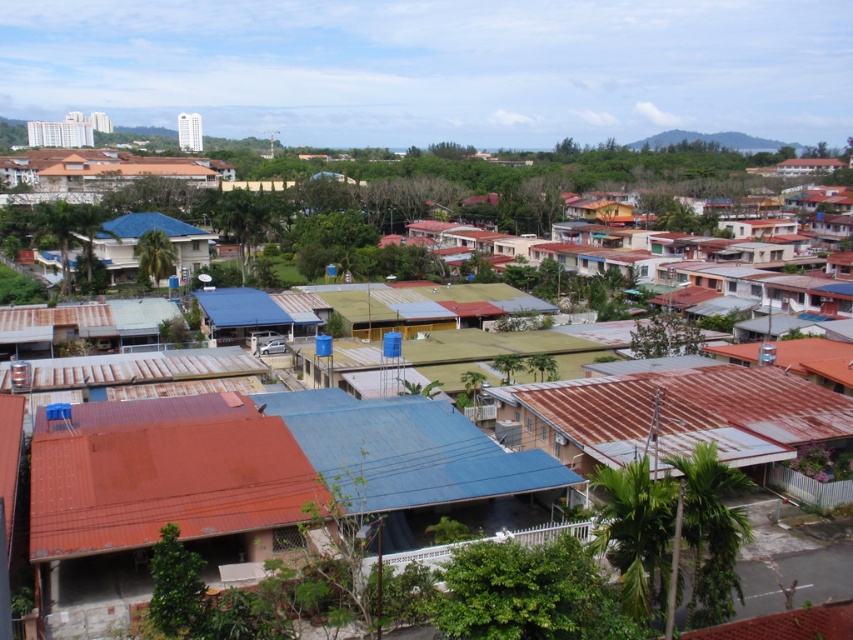
You are standing at the center of the residential area and want to locate the rusty metal hut at lower right. According to the coordinates provided, in which direction should you move to reach it?

The rusty metal hut at lower right is located at point (674, 417). Since you are at the center, moving towards the lower right direction will lead you to the rusty metal hut at lower right.

You are a delivery person trying to navigate through the residential area. You need to deliver a package to the blue matte house at center. From your current position at the rusty metal hut at lower right, which direction should you move to reach the house?

The rusty metal hut at lower right is positioned under the blue matte house at center, so you should move upward from the rusty metal hut at lower right to reach the blue matte house at center.

You are standing in the residential area and want to take a photo of the rusty corrugated metal hut at lower left without the rusty metal hut at lower right blocking the view. Is this possible?

The rusty corrugated metal hut at lower left is positioned under the rusty metal hut at lower right, so it is blocked by the latter. Therefore, you cannot take a photo of the rusty corrugated metal hut at lower left without the rusty metal hut at lower right blocking the view.